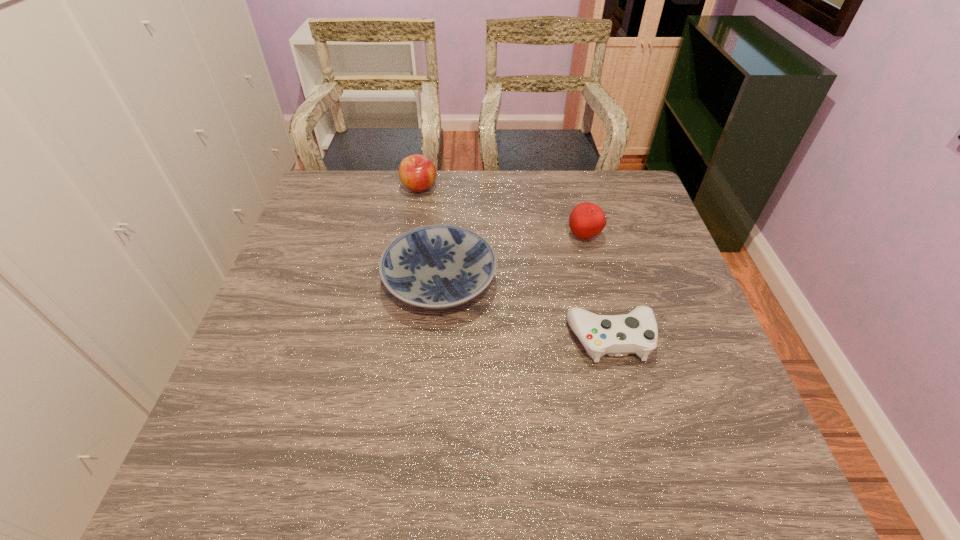
Identify the location of the farther apple. (417, 173).

Find the location of a particular element. The image size is (960, 540). the farthest object is located at coordinates (417, 173).

Where is `the nearer apple`? the nearer apple is located at coordinates (587, 220).

The height and width of the screenshot is (540, 960). Identify the location of plate. (437, 266).

Identify the location of control. The width and height of the screenshot is (960, 540). (636, 332).

At what (x,y) coordinates should I click in order to perform the action: click on free space located 0.100m on the right of the farther apple. Please return your answer as a coordinate pair (x, y). Looking at the image, I should click on (468, 188).

The width and height of the screenshot is (960, 540). In order to click on vacant area located on the left of the right apple in this screenshot , I will do `click(465, 237)`.

Locate an element on the screen. The width and height of the screenshot is (960, 540). free space located on the left of the plate is located at coordinates (314, 282).

This screenshot has width=960, height=540. Find the location of `blank space located 0.100m on the front of the control`. blank space located 0.100m on the front of the control is located at coordinates (629, 408).

Identify the location of object present at the far edge. (417, 173).